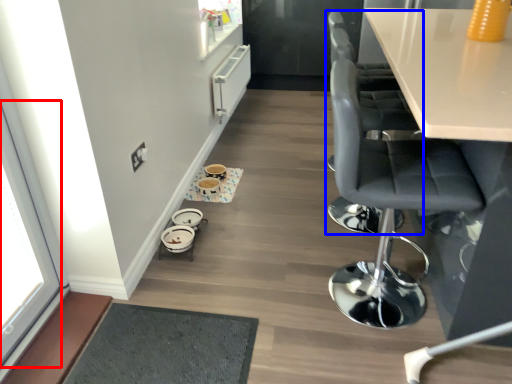
Question: Which object appears farthest to the camera in this image, window (highlighted by a red box) or chair (highlighted by a blue box)?

Choices:
 (A) window
 (B) chair

Answer: (B)